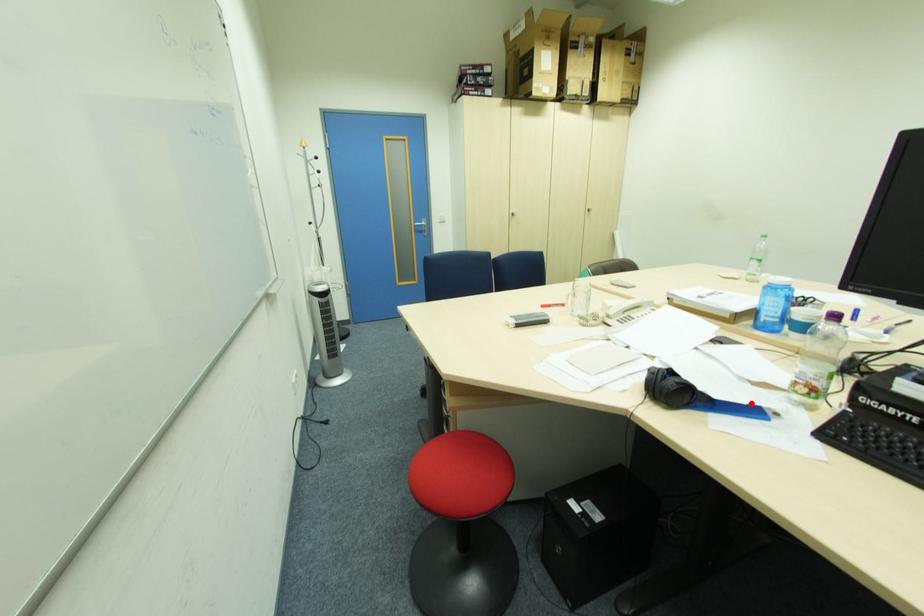
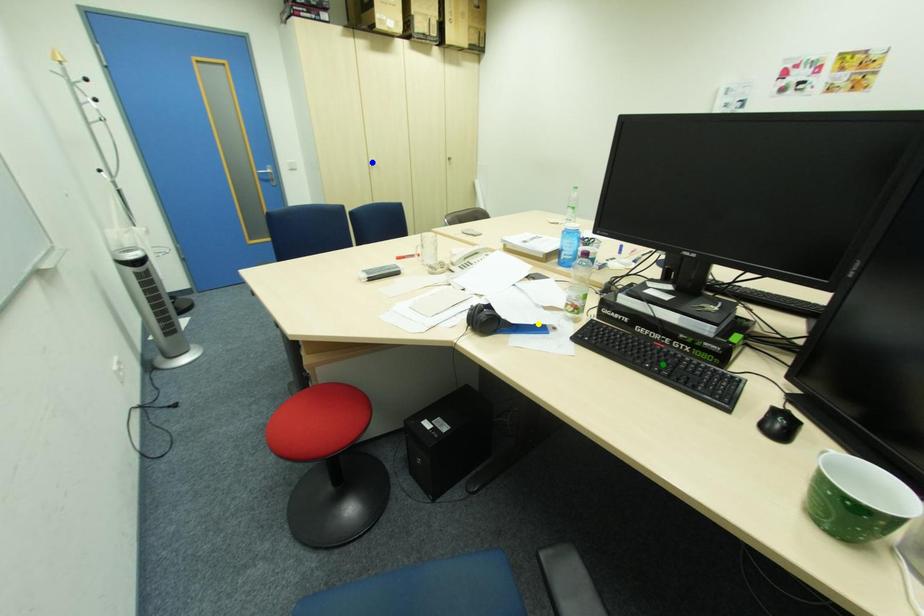
Question: I am providing you with two images of the same scene from different viewpoints. A red point is marked on the first image. You are given multiple points on the second image. Which spot in image 2 lines up with the point in image 1?

Choices:
 (A) yellow point
 (B) green point
 (C) blue point

Answer: (A)